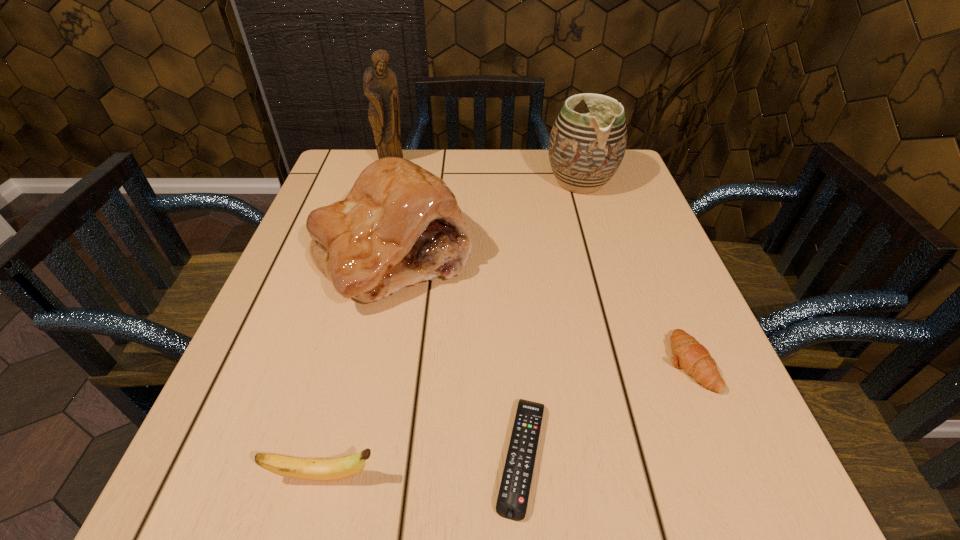
Image resolution: width=960 pixels, height=540 pixels. In order to click on the tallest object in this screenshot , I will do `click(380, 86)`.

The image size is (960, 540). I want to click on pottery, so click(x=585, y=150).

Identify the location of the third farthest object. Image resolution: width=960 pixels, height=540 pixels. (399, 225).

Locate an element on the screen. Image resolution: width=960 pixels, height=540 pixels. the fourth tallest object is located at coordinates (332, 469).

At what (x,y) coordinates should I click in order to perform the action: click on the fourth farthest object. Please return your answer as a coordinate pair (x, y). Looking at the image, I should click on pos(688,354).

This screenshot has width=960, height=540. What are the coordinates of `crescent roll` in the screenshot? It's located at (688, 354).

The width and height of the screenshot is (960, 540). Find the location of `the third object from right to left`. the third object from right to left is located at coordinates (512, 501).

In order to click on remote control in this screenshot , I will do `click(512, 501)`.

Identify the location of blank space located on the front-facing side of the figurine. The width and height of the screenshot is (960, 540). (381, 205).

At what (x,y) coordinates should I click in order to perform the action: click on vacant area situated on the left of the pottery. Please return your answer as a coordinate pair (x, y). Looking at the image, I should click on (401, 181).